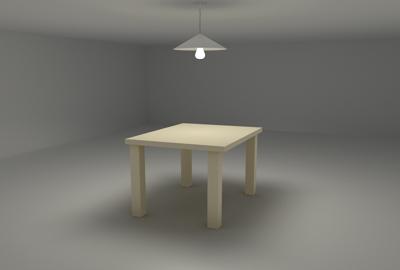
Find the location of a particular element. This screenshot has width=400, height=270. table legs is located at coordinates (211, 200), (254, 170), (183, 176), (137, 200).